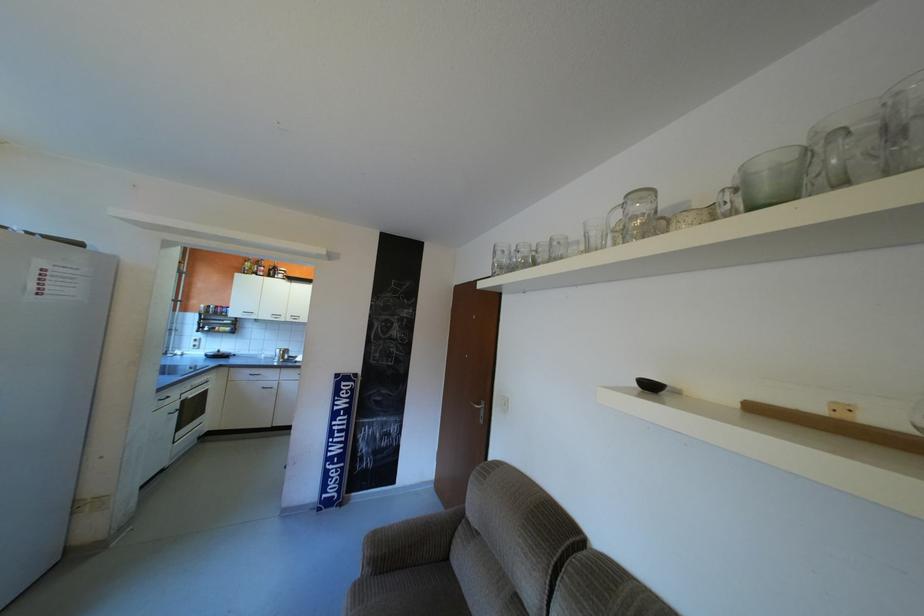
Where is `silver door handle`? The image size is (924, 616). silver door handle is located at coordinates (479, 410).